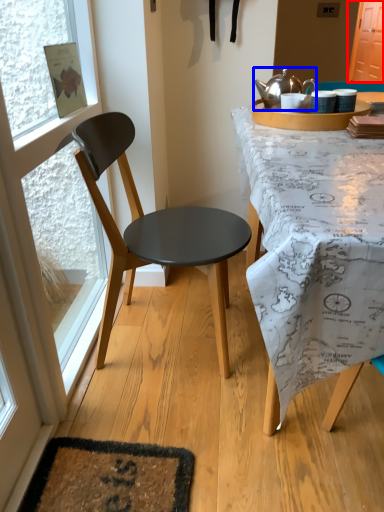
Question: Which point is further to the camera, screen door (highlighted by a red box) or kettle (highlighted by a blue box)?

Choices:
 (A) screen door
 (B) kettle

Answer: (A)